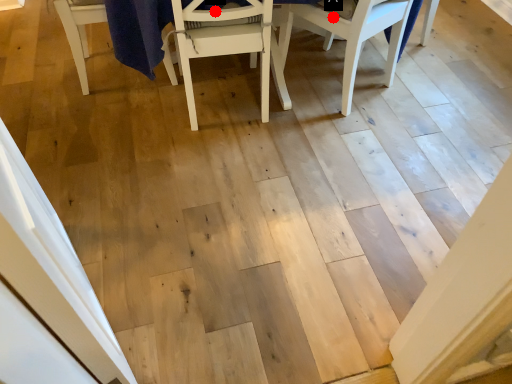
Question: Two points are circled on the image, labeled by A and B beside each circle. Which point is further to the camera?

Choices:
 (A) A is further
 (B) B is further

Answer: (A)